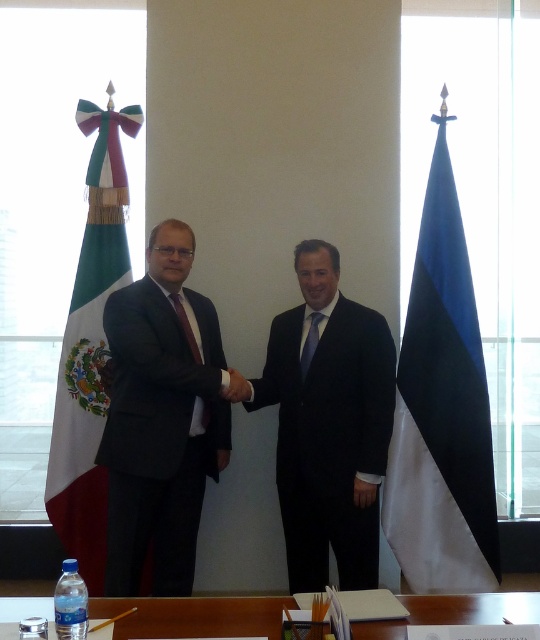
You are a photographer at the event and want to capture both the green fabric flag at left and the blue silk tie at center in the same frame. Based on their sizes, which object should you focus on to ensure both fit in the photo?

The green fabric flag at left might be wider than blue silk tie at center, so focusing on the flag would ensure both objects fit in the frame as the wider object requires more space.

You are a photographer standing in front of the blue fabric flag at right and the blue silk tie at center. You want to take a photo that includes both objects in the frame. Considering the distance between them, will you need to zoom out your camera lens to capture both objects in the same shot?

The distance between the blue fabric flag at right and blue silk tie at center is 33.77 inches. To capture both in the same frame, you would need to zoom out your camera lens to accommodate the space between them.